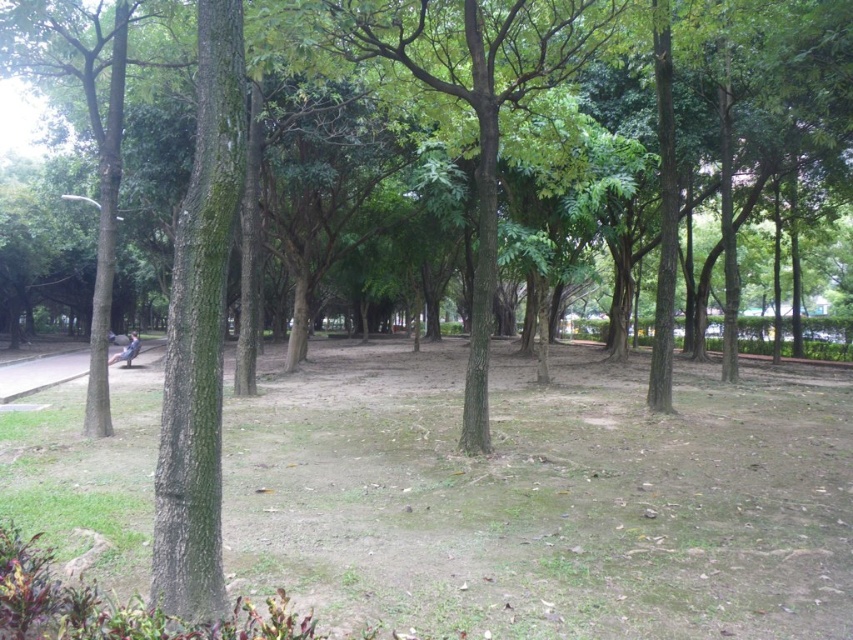
You are standing in the park and want to take a photo of both the green leafy tree at center and the brown rough tree at left. Which tree should you focus on first to ensure both are in the frame?

You should focus on the green leafy tree at center first because it is located above the brown rough tree at left, so adjusting the camera angle to include both would require framing from the top down.

You are standing at the center of the park and want to walk to the brown rough tree at left. Which direction should you head?

You should head to the left to reach the brown rough tree at left since it is located at point 0.200 on the x axis.

You are a hiker trying to follow the path in the park. You see the brown rough tree at left and the smooth concrete path at lower left. Which direction should you turn to stay on the path?

To stay on the path, you should turn to the left because the smooth concrete path at lower left is to the left of the brown rough tree at left, which is to the right of it.